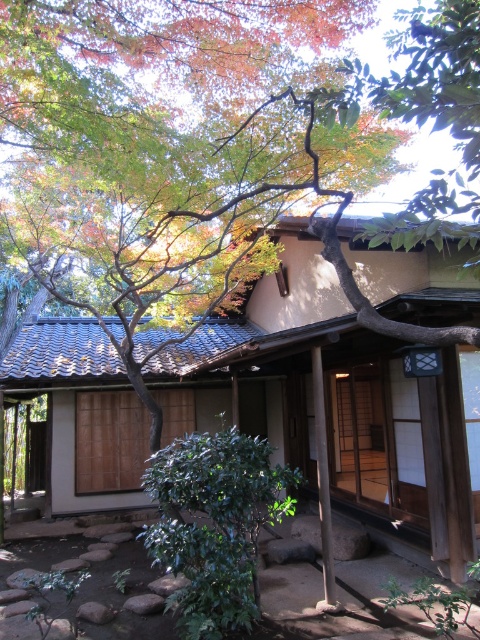
Question: Which of the following is the closest to the observer?

Choices:
 (A) green leafy bush at center
 (B) beige wooden hut at center

Answer: (B)

Question: Does beige wooden hut at center appear on the left side of green leafy bush at center?

Choices:
 (A) yes
 (B) no

Answer: (A)

Question: Which point is closer to the camera?

Choices:
 (A) (230, 573)
 (B) (384, 440)

Answer: (A)

Question: Which object appears closest to the camera in this image?

Choices:
 (A) beige wooden hut at center
 (B) green leafy bush at center

Answer: (A)

Question: Does beige wooden hut at center have a lesser width compared to green leafy bush at center?

Choices:
 (A) no
 (B) yes

Answer: (A)

Question: Is beige wooden hut at center smaller than green leafy bush at center?

Choices:
 (A) yes
 (B) no

Answer: (B)